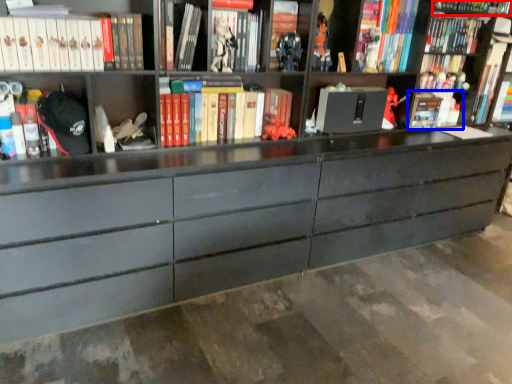
Question: Which of the following is the farthest to the observer, book (highlighted by a red box) or book (highlighted by a blue box)?

Choices:
 (A) book
 (B) book

Answer: (B)